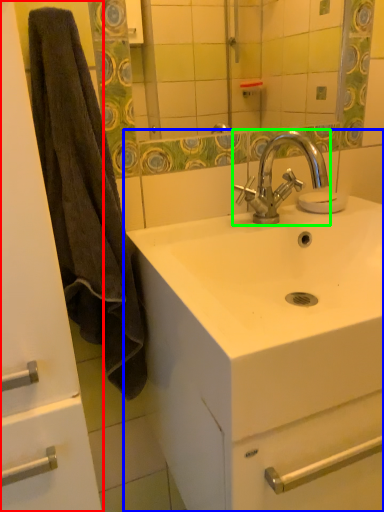
Question: Which object is positioned closest to bathroom cabinet (highlighted by a red box)? Select from sink (highlighted by a blue box) and tap (highlighted by a green box).

Choices:
 (A) sink
 (B) tap

Answer: (A)